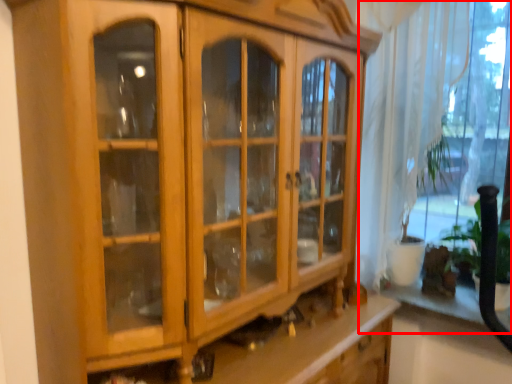
Question: From the image's perspective, what is the correct spatial positioning of window (annotated by the red box) in reference to shelf?

Choices:
 (A) below
 (B) above

Answer: (B)